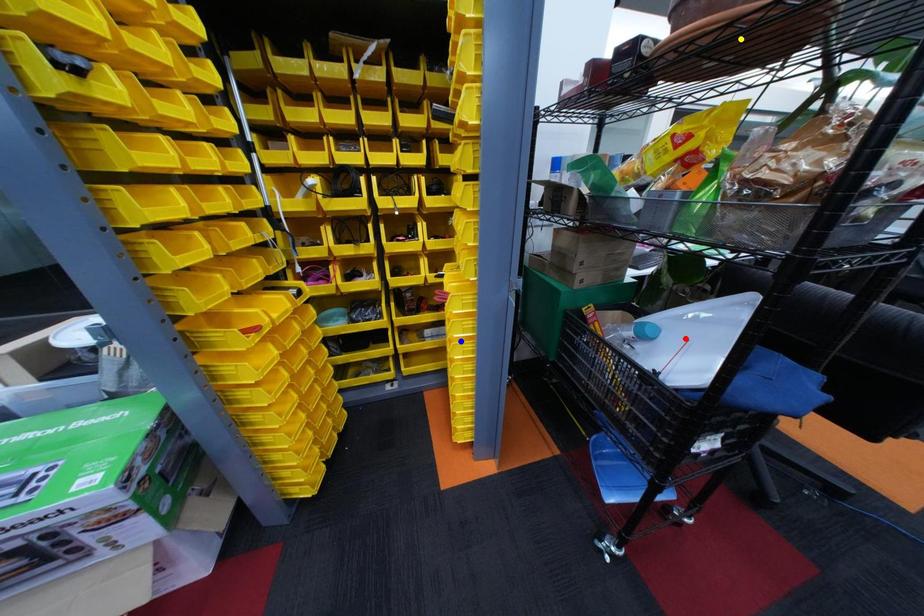
Order these from nearest to farthest:
blue point
yellow point
red point

yellow point, red point, blue point